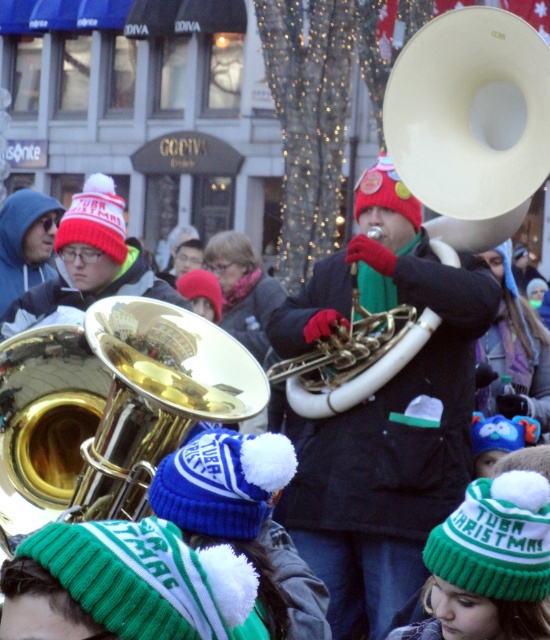
Which of these two, gold brass tuba at center or white glossy trumpet at center, stands taller?

gold brass tuba at center

Does point (381, 506) lie in front of point (280, 371)?

Yes, point (381, 506) is closer to viewer.

Identify the location of gold brass tuba at center. The width and height of the screenshot is (550, 640). (383, 412).

Where is `gold brass tuba at center`? gold brass tuba at center is located at coordinates (383, 412).

Which is above, gold brass tuba at center or gold shiny trumpet at center?

gold brass tuba at center is above.

Image resolution: width=550 pixels, height=640 pixels. What do you see at coordinates (383, 412) in the screenshot? I see `gold brass tuba at center` at bounding box center [383, 412].

This screenshot has height=640, width=550. I want to click on gold brass tuba at center, so click(x=383, y=412).

Who is more distant from viewer, (393, 145) or (364, 365)?

The point (393, 145) is behind.

Is point (513, 42) positioned behind point (414, 321)?

Yes, point (513, 42) is farther from viewer.

Identify the location of white matte bass horn at upper center. (470, 122).

The image size is (550, 640). I want to click on white matte bass horn at upper center, so click(470, 122).